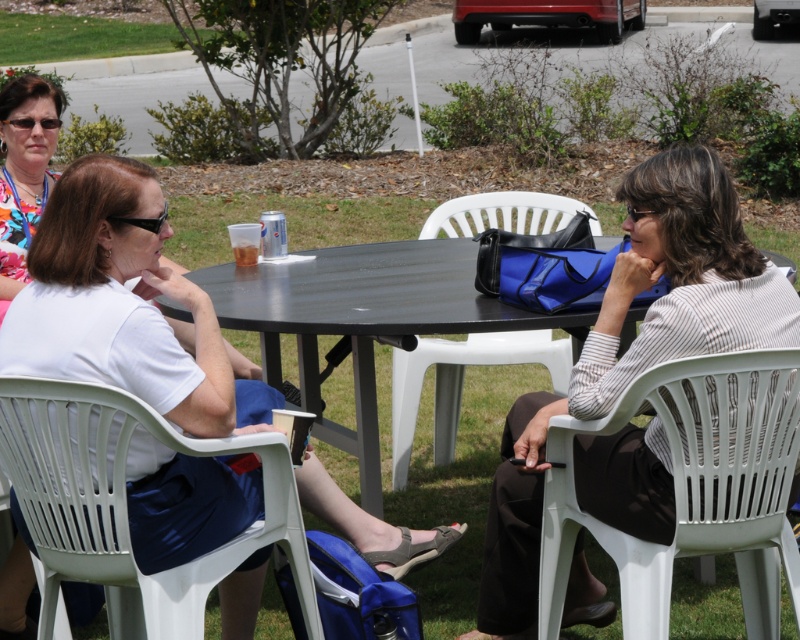
You are a person with a 32 inch wide backpack. You want to walk between the white plastic chair at right and the black plastic table at center. Is there enough space for you and your backpack to pass through?

The distance between the white plastic chair at right and the black plastic table at center is 35.22 inches. Since your backpack is 32 inches wide, there is enough space for you and your backpack to pass through as 35.22 inches is greater than 32 inches.

You are standing at the center of the image and want to move to the white plastic chair at lower left. Which direction should you move in?

You should move to the lower left direction to reach the white plastic chair at lower left.

You are planning to set up a small picnic area for four people. You have a white plastic chair at right and a black plastic table at center. Considering their sizes, which object would you prioritize moving to accommodate more seating?

The white plastic chair at right occupies less space than the black plastic table at center, so you should prioritize moving the black plastic table at center to free up more space for additional seating.